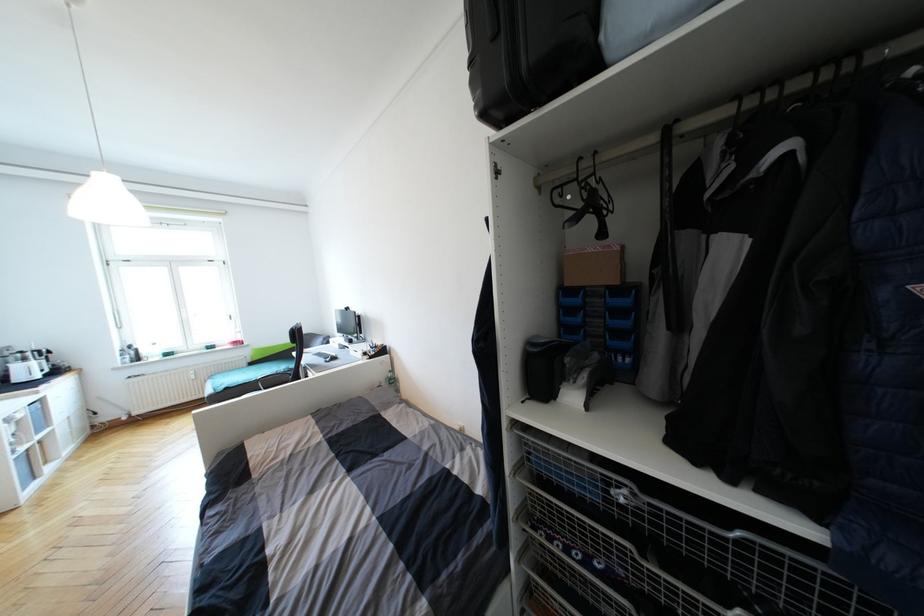
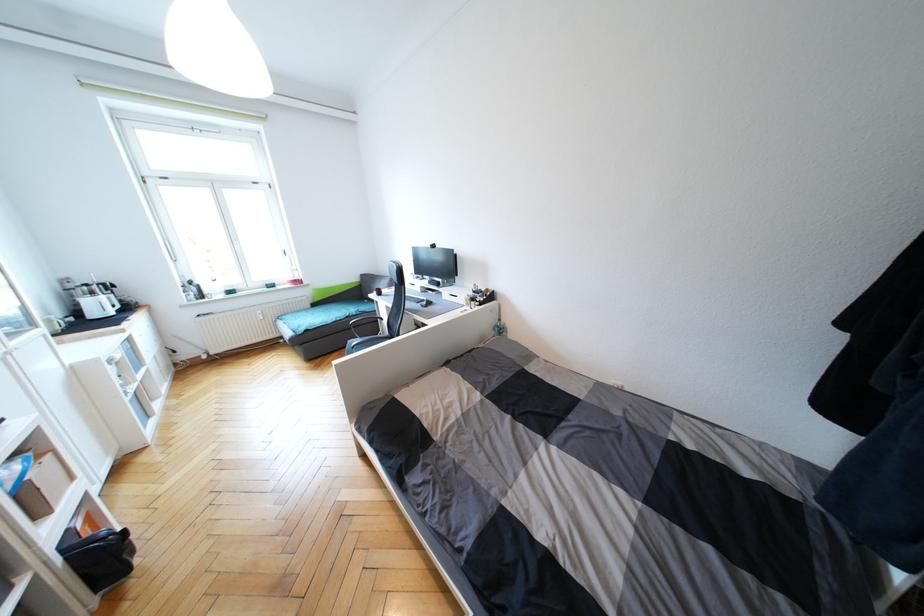
In the second image, find the point that corresponds to [368,355] in the first image.

(476, 301)